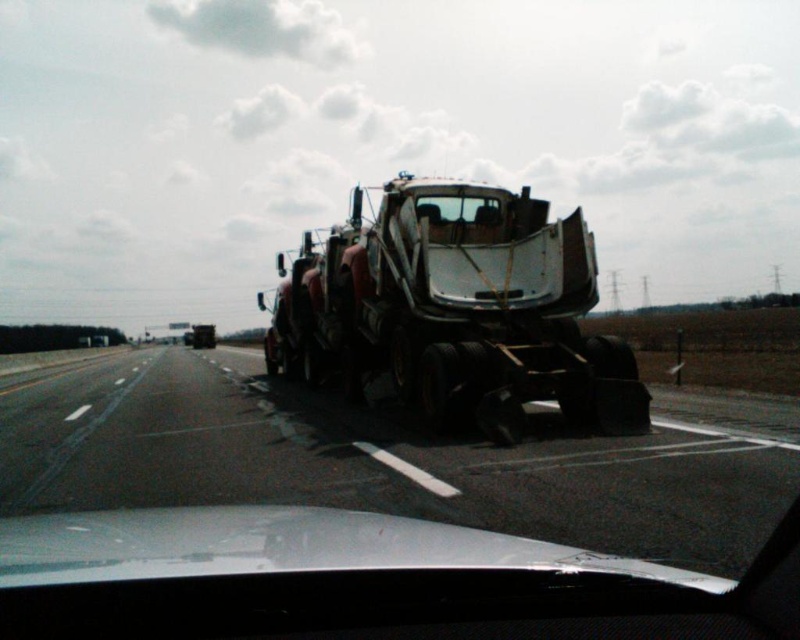
You are driving a car and see the black asphalt highway at center and the rusty metal tow truck at center. Which object is closer to the ground?

The black asphalt highway at center is closer to the ground because it is located below the rusty metal tow truck at center.

You are driving a car with a trunk that is 5 feet long. You want to place both the rusty metal tow truck at center and the clear glass windshield at center into your trunk. Can both items fit in the trunk if they are placed side by side?

The distance between the rusty metal tow truck at center and the clear glass windshield at center is 6.06 feet. Since your trunk is only 5 feet long, placing them side by side would not fit as 6.06 feet exceeds the trunk length of 5 feet.